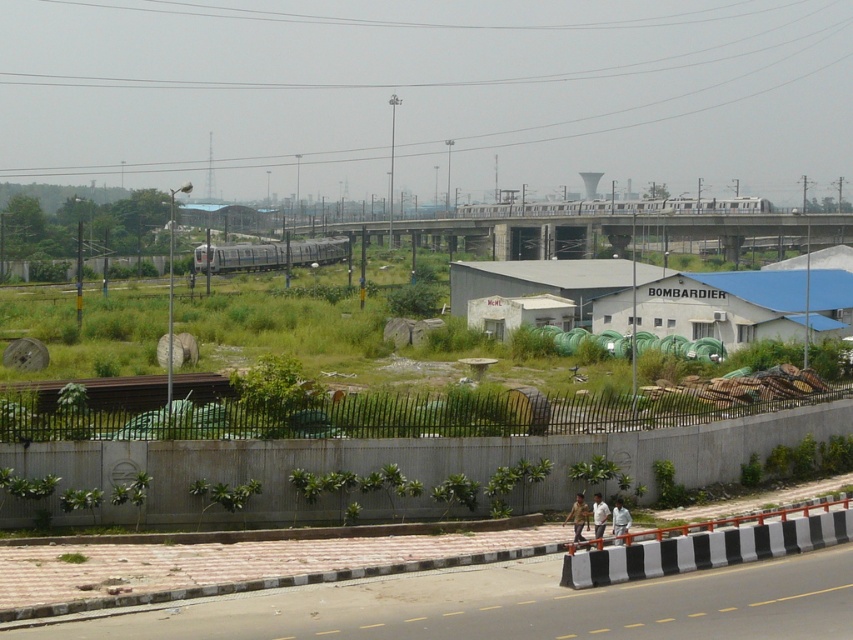
Question: Is silver metallic train at center below camouflage uniform at center?

Choices:
 (A) no
 (B) yes

Answer: (A)

Question: Which point is closer to the camera?

Choices:
 (A) metal/concrete bridge at center
 (B) white cotton shirt at lower center
 (C) black and white striped barrier at lower center

Answer: (C)

Question: Observing the image, what is the correct spatial positioning of black metal fence at lower center in reference to brown metallic train track at lower center?

Choices:
 (A) below
 (B) above

Answer: (A)

Question: Which object appears farthest from the camera in this image?

Choices:
 (A) black and white striped barrier at lower center
 (B) metal/concrete bridge at center
 (C) black metal fence at lower center
 (D) white fabric shirt at lower right

Answer: (B)

Question: Which point appears farthest from the camera in this image?

Choices:
 (A) (601, 508)
 (B) (277, 483)
 (C) (575, 531)
 (D) (668, 529)

Answer: (B)

Question: Can you confirm if black and white striped barrier at lower center is positioned below silver metallic train at center?

Choices:
 (A) no
 (B) yes

Answer: (B)